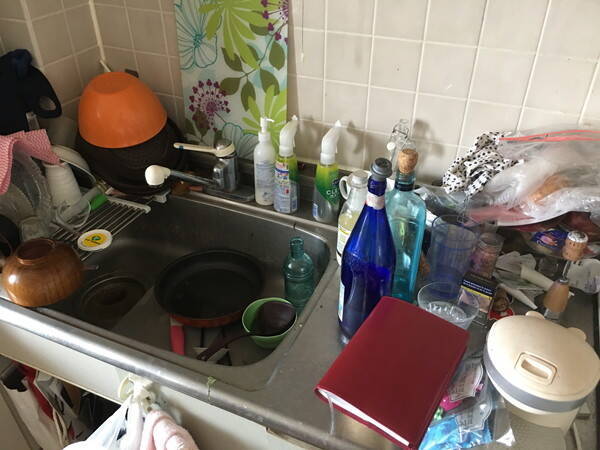
This screenshot has width=600, height=450. In order to click on spoon in this screenshot , I will do `click(224, 343)`.